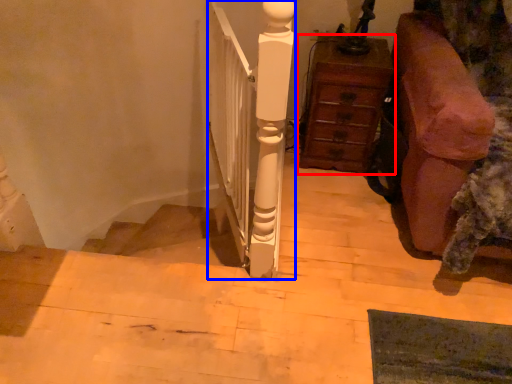
Question: Which of the following is the closest to the observer, chest of drawers (highlighted by a red box) or rail (highlighted by a blue box)?

Choices:
 (A) chest of drawers
 (B) rail

Answer: (B)